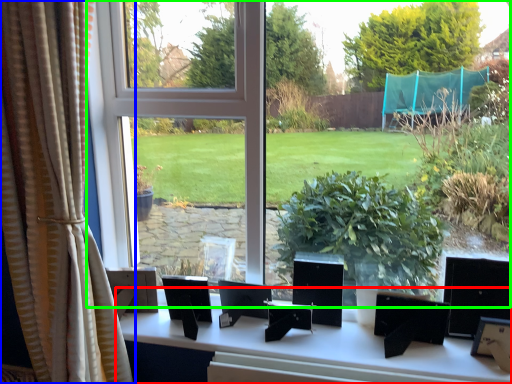
Question: Which object is positioned farthest from table (highlighted by a red box)? Select from curtain (highlighted by a blue box) and window (highlighted by a green box).

Choices:
 (A) curtain
 (B) window

Answer: (B)